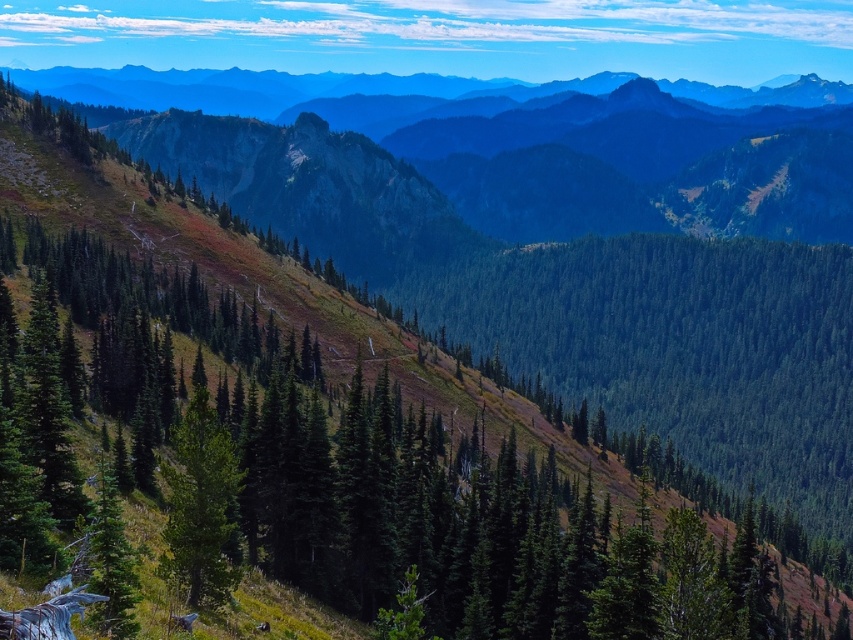
Between green forested mountain range at upper center and green matte tree at center, which one is positioned higher?

green forested mountain range at upper center is higher up.

Is green forested mountain range at upper center thinner than green matte tree at center?

No, green forested mountain range at upper center is not thinner than green matte tree at center.

Is point (450, 141) farther from camera compared to point (218, 435)?

Yes.

Find the location of a particular element. green forested mountain range at upper center is located at coordinates (554, 144).

Based on the photo, does green textured trees at center appear on the left side of green forested mountain range at upper center?

Correct, you'll find green textured trees at center to the left of green forested mountain range at upper center.

Is green textured trees at center positioned in front of green forested mountain range at upper center?

Yes.

Between point (422, 460) and point (647, 200), which one is positioned behind?

Point (647, 200)

This screenshot has width=853, height=640. What are the coordinates of `green textured trees at center` in the screenshot? It's located at (323, 460).

Is point (297, 556) closer to camera compared to point (215, 481)?

No, (297, 556) is further to viewer.

Who is positioned more to the right, green textured trees at center or green matte tree at center?

Positioned to the right is green textured trees at center.

What do you see at coordinates (323, 460) in the screenshot?
I see `green textured trees at center` at bounding box center [323, 460].

This screenshot has width=853, height=640. Find the location of `green textured trees at center`. green textured trees at center is located at coordinates (x=323, y=460).